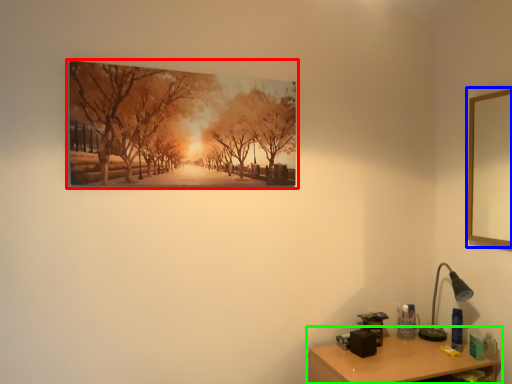
Question: Which object is positioned farthest from picture frame (highlighted by a red box)? Select from picture frame (highlighted by a blue box) and table (highlighted by a green box).

Choices:
 (A) picture frame
 (B) table

Answer: (A)